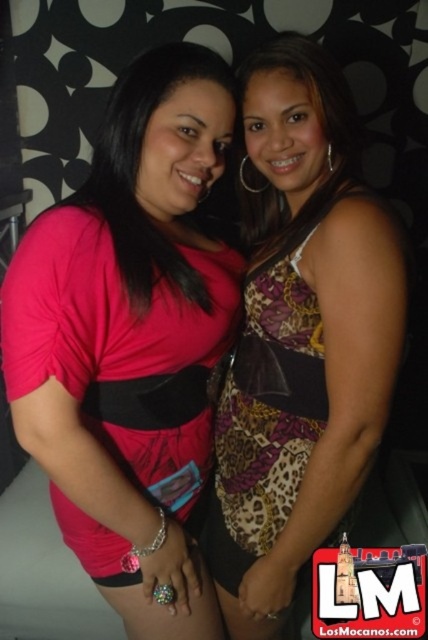
Consider the image. Does pink matte shirt at center appear on the right side of leopard print dress at center?

No, pink matte shirt at center is not to the right of leopard print dress at center.

Is pink matte shirt at center positioned behind leopard print dress at center?

No.

The width and height of the screenshot is (428, 640). Identify the location of pink matte shirt at center. (130, 340).

Does leopard print dress at center appear on the right side of matte pink shirt at center?

Indeed, leopard print dress at center is positioned on the right side of matte pink shirt at center.

Which is above, leopard print dress at center or matte pink shirt at center?

matte pink shirt at center

Which is behind, point (356, 141) or point (109, 140)?

Point (356, 141)

Where is `leopard print dress at center`? Image resolution: width=428 pixels, height=640 pixels. leopard print dress at center is located at coordinates 300,337.

How distant is pink matte shirt at center from matte pink shirt at center?

pink matte shirt at center is 4.55 inches away from matte pink shirt at center.

From the picture: Between pink matte shirt at center and matte pink shirt at center, which one appears on the left side from the viewer's perspective?

pink matte shirt at center

I want to click on pink matte shirt at center, so click(x=130, y=340).